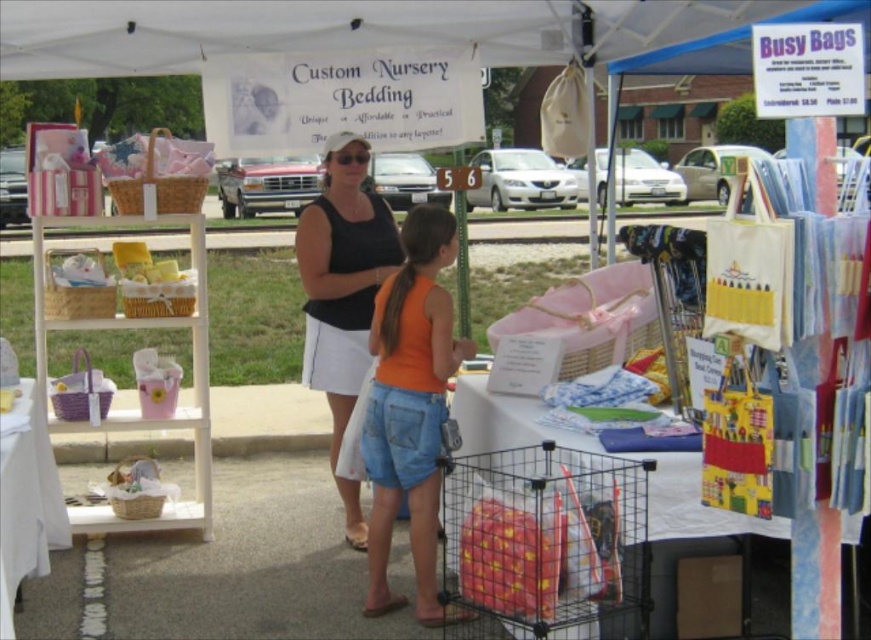
Question: Is metallic wire shopping cart at center positioned before black matte tank top at center?

Choices:
 (A) yes
 (B) no

Answer: (A)

Question: Is metallic wire shopping cart at center below orange denim shorts at center?

Choices:
 (A) no
 (B) yes

Answer: (B)

Question: Is the position of orange denim shorts at center less distant than that of black matte tank top at center?

Choices:
 (A) no
 (B) yes

Answer: (B)

Question: Based on their relative distances, which object is nearer to the orange denim shorts at center?

Choices:
 (A) black matte tank top at center
 (B) metallic wire shopping cart at center

Answer: (B)

Question: Among these objects, which one is nearest to the camera?

Choices:
 (A) metallic wire shopping cart at center
 (B) orange denim shorts at center

Answer: (A)

Question: Which object is the closest to the metallic wire shopping cart at center?

Choices:
 (A) black matte tank top at center
 (B) orange denim shorts at center

Answer: (B)